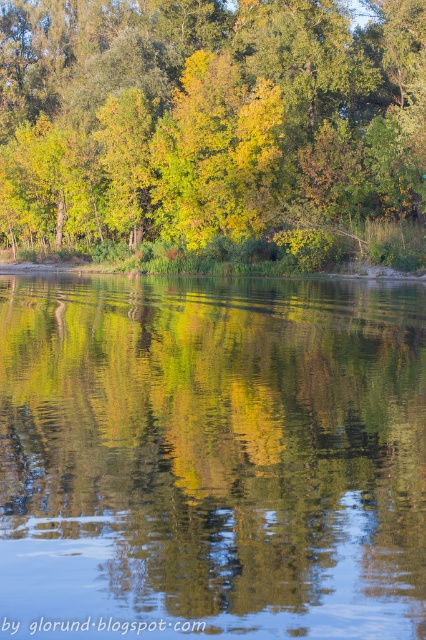
Can you confirm if transparent water at center is smaller than green leafy tree at upper center?

Correct, transparent water at center occupies less space than green leafy tree at upper center.

What do you see at coordinates (212, 458) in the screenshot?
I see `transparent water at center` at bounding box center [212, 458].

Find the location of a particular element. The height and width of the screenshot is (640, 426). transparent water at center is located at coordinates (212, 458).

Where is `transparent water at center`? The image size is (426, 640). transparent water at center is located at coordinates (212, 458).